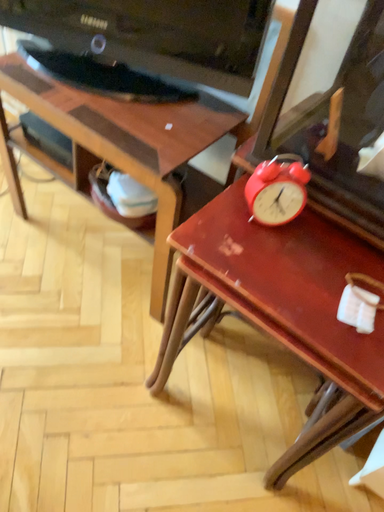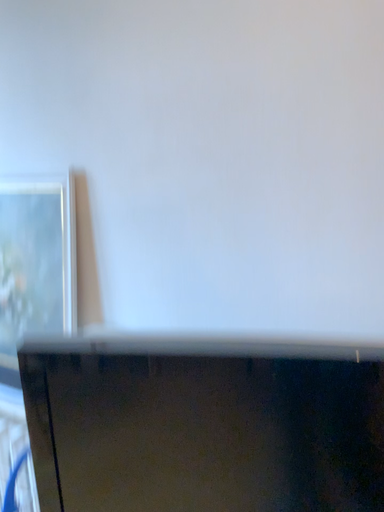
Question: Which way did the camera rotate in the video?

Choices:
 (A) rotated upward
 (B) rotated downward

Answer: (A)